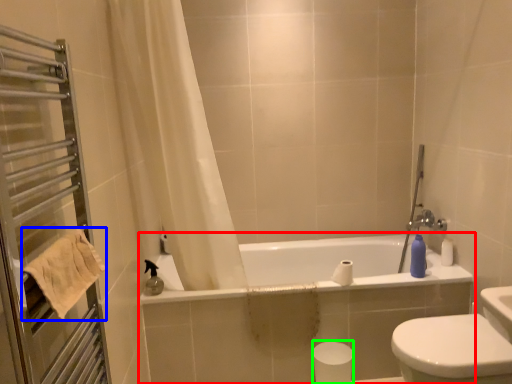
Question: Which object is the farthest from bathtub (highlighted by a red box)? Choose among these: towel/napkin (highlighted by a blue box) or toilet paper (highlighted by a green box).

Choices:
 (A) towel/napkin
 (B) toilet paper

Answer: (A)